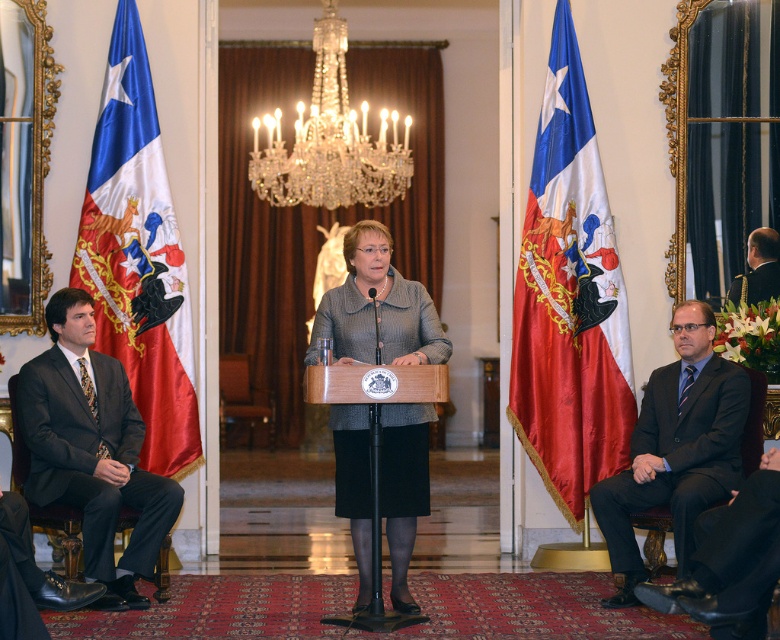
Question: Which of the following is the farthest from the observer?

Choices:
 (A) silky red flag at center
 (B) matte gray blazer at center
 (C) clear crystal chandelier at center

Answer: (C)

Question: Does silky red flag at left appear over matte gray blazer at center?

Choices:
 (A) yes
 (B) no

Answer: (A)

Question: Which of the following is the closest to the observer?

Choices:
 (A) silky red flag at left
 (B) dark blue suit at right
 (C) dark gray suit at left

Answer: (C)

Question: Considering the relative positions of silky red flag at left and dark gray suit at left in the image provided, where is silky red flag at left located with respect to dark gray suit at left?

Choices:
 (A) below
 (B) above

Answer: (B)

Question: Does matte gray blazer at center appear over dark blue suit at right?

Choices:
 (A) yes
 (B) no

Answer: (B)

Question: Based on their relative distances, which object is farther from the dark gray suit at right?

Choices:
 (A) matte gray blazer at center
 (B) silky red flag at left
 (C) dark blue suit at right
 (D) clear crystal chandelier at center

Answer: (D)